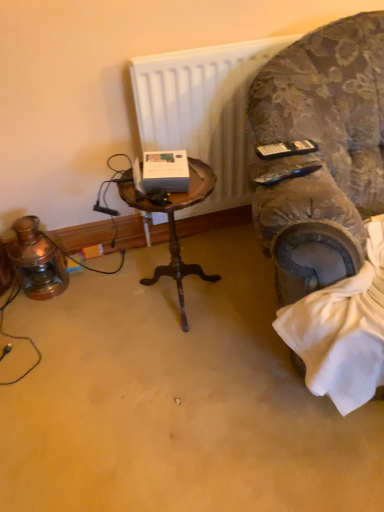
Where is `unoccupied area in front of white matte radiator at upper center`? The height and width of the screenshot is (512, 384). unoccupied area in front of white matte radiator at upper center is located at coordinates (216, 273).